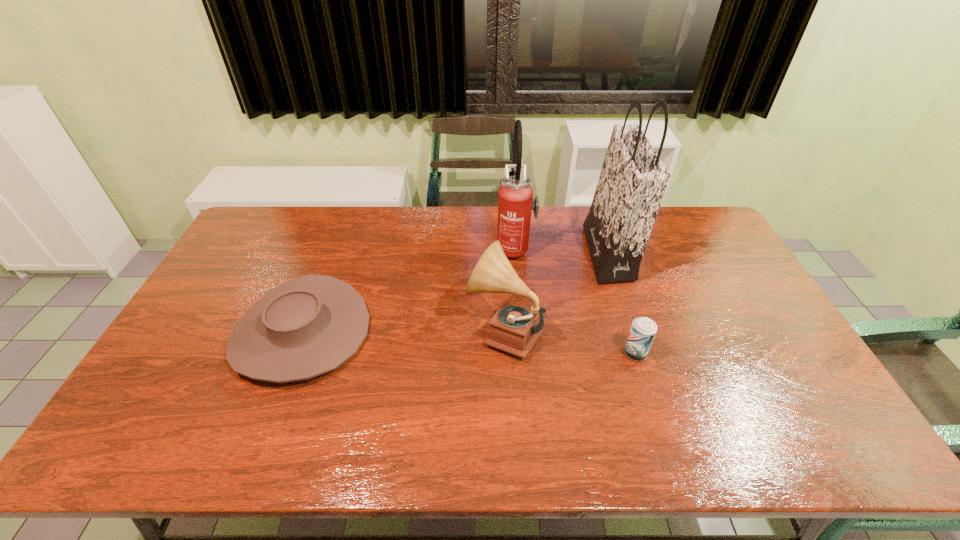
Identify the location of shopping bag. The image size is (960, 540). (633, 179).

I want to click on the second tallest object, so click(515, 196).

This screenshot has width=960, height=540. Find the location of `the third shortest object`. the third shortest object is located at coordinates (514, 329).

I want to click on beer can, so click(x=643, y=330).

Image resolution: width=960 pixels, height=540 pixels. I want to click on the leftmost object, so click(308, 326).

Image resolution: width=960 pixels, height=540 pixels. What are the coordinates of `cowboy hat` in the screenshot? It's located at (308, 326).

Locate an element on the screen. blank area located on the front of the shopping bag with the design is located at coordinates (482, 253).

Image resolution: width=960 pixels, height=540 pixels. I want to click on vacant region located 0.310m on the front of the shopping bag with the design, so click(x=499, y=253).

Identify the location of vacant area located 0.190m on the front of the shopping bag with the design. (534, 253).

Where is `vacant space located 0.060m at the nozzle of the second tallest object`? The width and height of the screenshot is (960, 540). vacant space located 0.060m at the nozzle of the second tallest object is located at coordinates (479, 248).